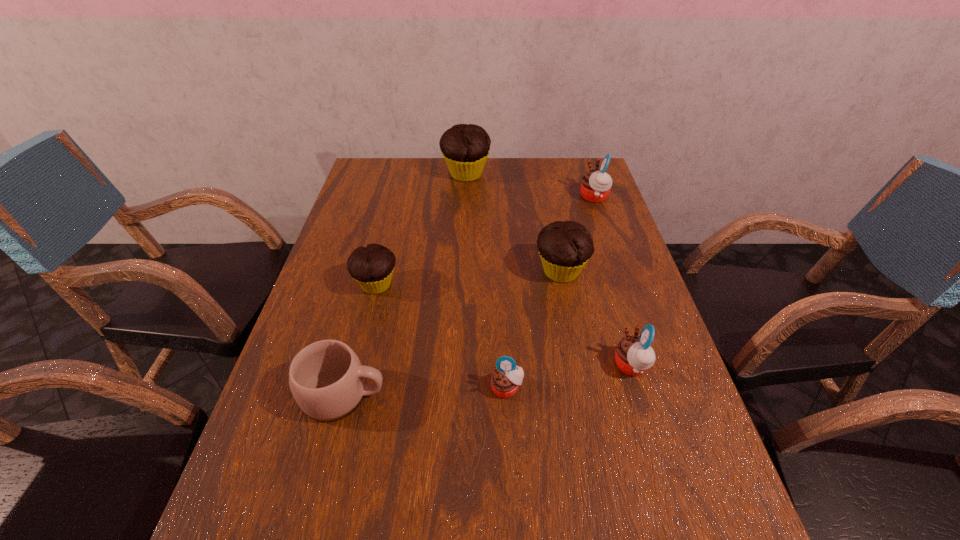
This screenshot has width=960, height=540. Identify the location of free space located 0.050m on the back of the smallest chocolate muffin. click(x=383, y=258).

Identify the location of blank space located 0.190m on the side of the mug with the handle. The height and width of the screenshot is (540, 960). (478, 395).

Identify the location of blank space located 0.080m on the front-facing side of the shortest object. (509, 438).

Where is `muffin that is at the left edge`? The height and width of the screenshot is (540, 960). muffin that is at the left edge is located at coordinates (372, 267).

The image size is (960, 540). I want to click on mug present at the left edge, so click(326, 378).

Locate an element on the screen. Image resolution: width=960 pixels, height=540 pixels. object that is at the far right corner is located at coordinates (596, 185).

The width and height of the screenshot is (960, 540). In order to click on vacant point at the far edge in this screenshot , I will do `click(514, 188)`.

Where is `vacant point at the right edge`? vacant point at the right edge is located at coordinates (591, 232).

You are a GUI agent. You are given a task and a screenshot of the screen. Output one action in this format:
    pyautogui.click(x=<x>, y=<y>)
    Task: Click on the free space at the far left corner
    This screenshot has height=540, width=960.
    Given the screenshot: What is the action you would take?
    pyautogui.click(x=362, y=167)

Find the location of `blank space at the far right corner of the desktop`. blank space at the far right corner of the desktop is located at coordinates (588, 167).